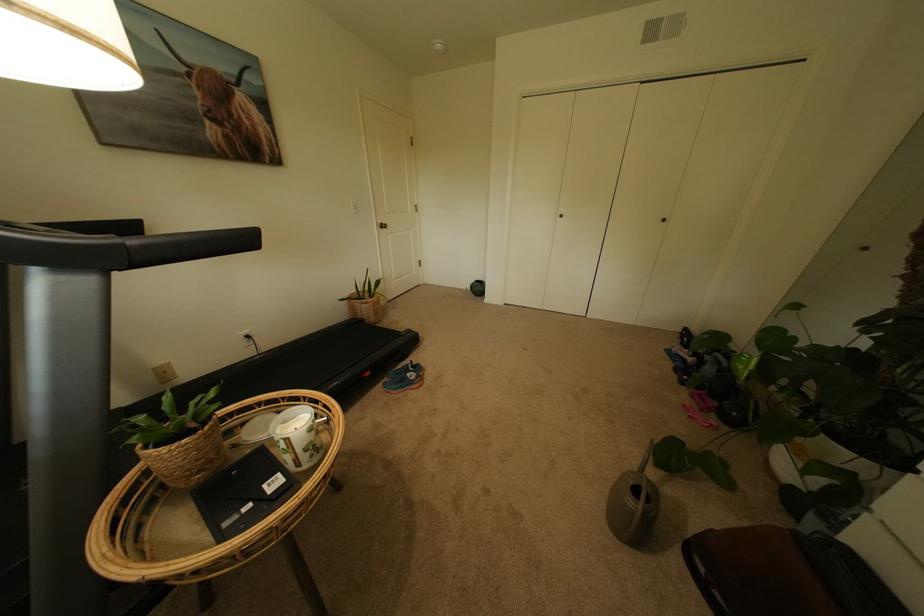
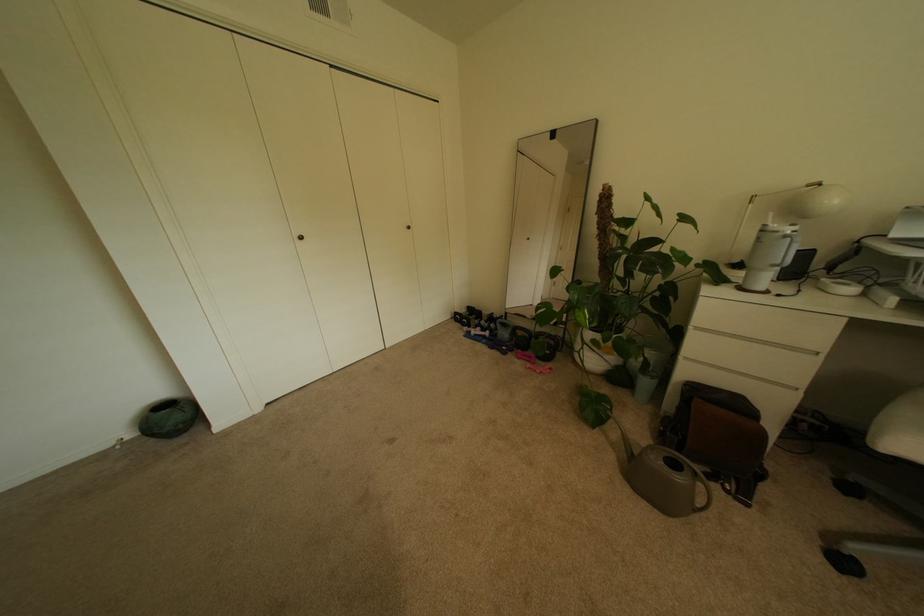
Where in the second image is the point corresponding to (714,392) from the first image?

(524, 350)